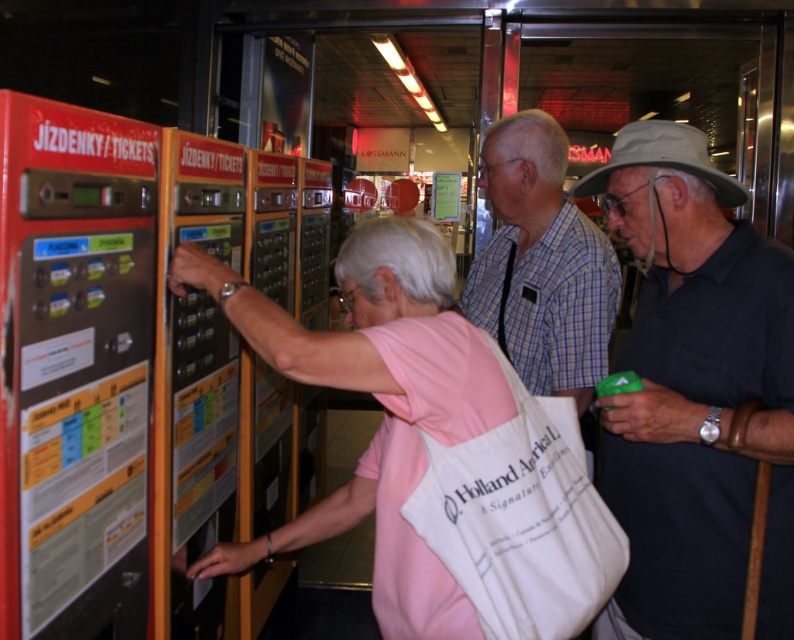
You are a traveler in a train station and you see a pink fabric bag at center and a plaid cotton shirt at center. Which item is located lower?

The pink fabric bag at center is positioned under the plaid cotton shirt at center, so it is located lower.

You are a traveler at the ticket vending machines in the station. You have a pink fabric bag at center and a plaid cotton shirt at center. If you want to place both items on the counter without overlapping, which item should you place first to ensure they both fit?

The plaid cotton shirt at center should be placed first because the pink fabric bag at center might be wider, so placing the wider item first allows for proper arrangement.

You are a traveler at the station and need to locate your companion who is wearing a pink fabric bag at center. From your vantage point, where would you look relative to the black fabric hat at upper right?

The black fabric hat at upper right is above the pink fabric bag at center, so you should look downward from the black fabric hat at upper right to find the pink fabric bag at center.